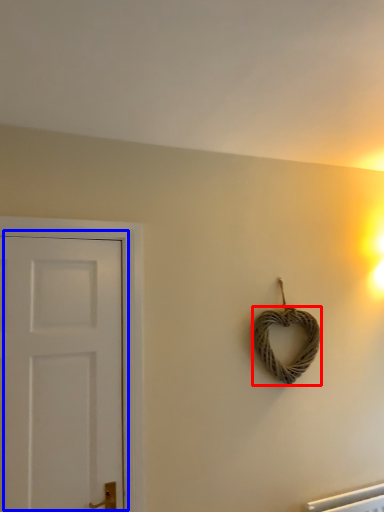
Question: Which object is further to the camera taking this photo, rope (highlighted by a red box) or door (highlighted by a blue box)?

Choices:
 (A) rope
 (B) door

Answer: (A)